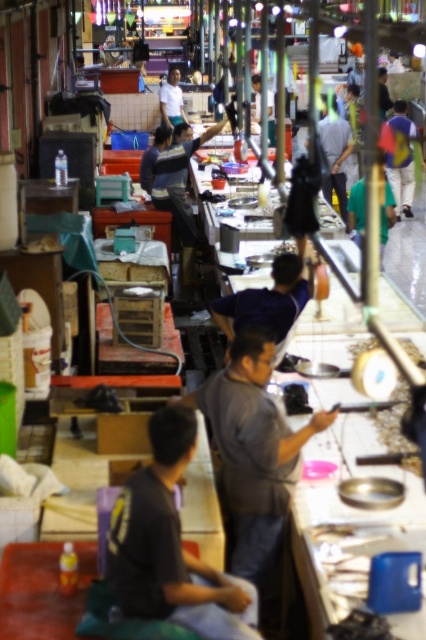
Question: Which object is positioned closest to the dark gray shirt at lower center?

Choices:
 (A) dark blue shirt at center
 (B) gray matte shirt at center
 (C) light blue shirt at center

Answer: (B)

Question: Does gray matte shirt at center come in front of blue fabric shirt at upper right?

Choices:
 (A) yes
 (B) no

Answer: (A)

Question: In this image, where is gray matte shirt at center located relative to dark blue shirt at center?

Choices:
 (A) right
 (B) left

Answer: (B)

Question: Is dark gray shirt at lower center to the right of blue fabric shirt at upper right from the viewer's perspective?

Choices:
 (A) yes
 (B) no

Answer: (B)

Question: Which object is the closest to the dark gray shirt at lower center?

Choices:
 (A) blue fabric shirt at upper right
 (B) dark blue shirt at center
 (C) light blue shirt at center

Answer: (B)

Question: Which object is farther from the camera taking this photo?

Choices:
 (A) dark gray shirt at lower center
 (B) dark blue shirt at center

Answer: (B)